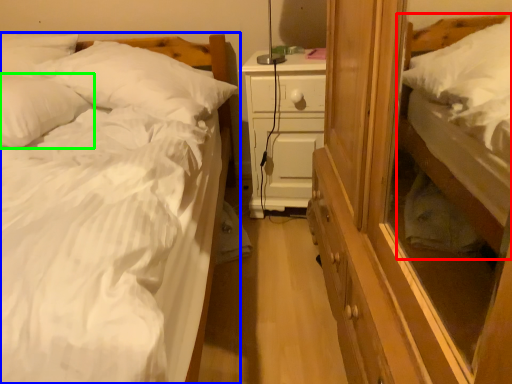
Question: Which object is positioned closest to bed (highlighted by a red box)? Select from bed (highlighted by a blue box) and pillow (highlighted by a green box).

Choices:
 (A) bed
 (B) pillow

Answer: (A)